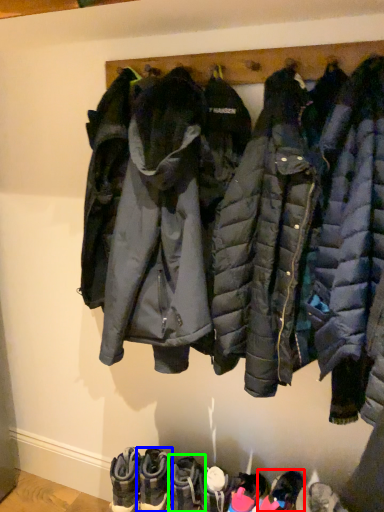
Question: Based on their relative distances, which object is farther from footwear (highlighted by a red box)? Choose from footwear (highlighted by a blue box) and footwear (highlighted by a green box).

Choices:
 (A) footwear
 (B) footwear

Answer: (A)